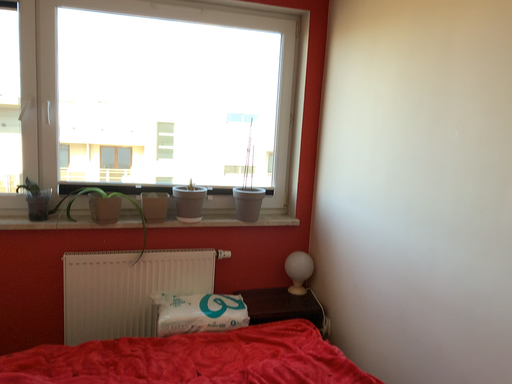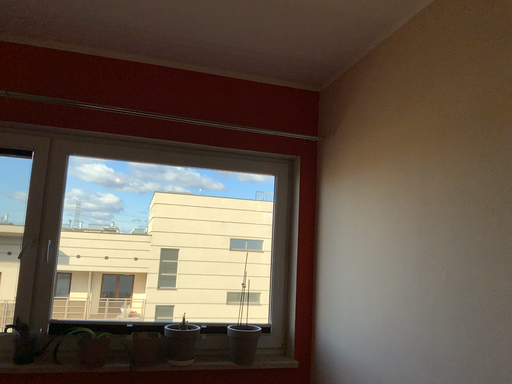
Question: Which way did the camera rotate in the video?

Choices:
 (A) rotated downward
 (B) rotated upward

Answer: (B)